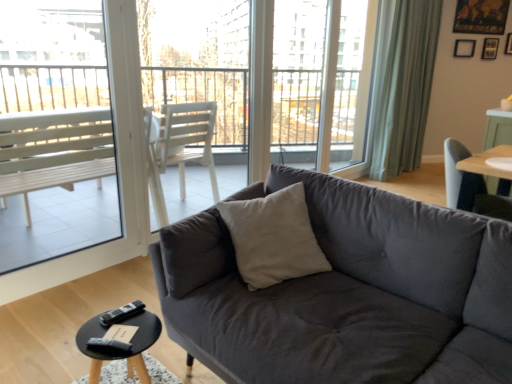
Question: Considering the relative sizes of black wood coffee table at lower left and black matte picture frame at upper right, marked as the 1th picture frame in a left-to-right arrangement, in the image provided, is black wood coffee table at lower left taller than black matte picture frame at upper right, marked as the 1th picture frame in a left-to-right arrangement,?

Choices:
 (A) no
 (B) yes

Answer: (B)

Question: Is black wood coffee table at lower left facing towards black matte picture frame at upper right, the 2th picture frame viewed from the right?

Choices:
 (A) no
 (B) yes

Answer: (A)

Question: Considering the relative sizes of black wood coffee table at lower left and black matte picture frame at upper right, the 2th picture frame viewed from the right, in the image provided, is black wood coffee table at lower left smaller than black matte picture frame at upper right, the 2th picture frame viewed from the right,?

Choices:
 (A) yes
 (B) no

Answer: (B)

Question: Is black wood coffee table at lower left next to black matte picture frame at upper right, the 2th picture frame viewed from the right?

Choices:
 (A) no
 (B) yes

Answer: (A)

Question: Is black wood coffee table at lower left at the left side of black matte picture frame at upper right, the 2th picture frame viewed from the right?

Choices:
 (A) yes
 (B) no

Answer: (A)

Question: From the image's perspective, is dark gray fabric couch at center above or below wooden picture frame at upper right, the 1th picture frame in the right-to-left sequence?

Choices:
 (A) above
 (B) below

Answer: (B)

Question: In the image, is dark gray fabric couch at center positioned in front of or behind wooden picture frame at upper right, the 1th picture frame in the right-to-left sequence?

Choices:
 (A) front
 (B) behind

Answer: (A)

Question: Does point (312, 196) appear closer or farther from the camera than point (492, 46)?

Choices:
 (A) farther
 (B) closer

Answer: (B)

Question: In terms of width, does dark gray fabric couch at center look wider or thinner when compared to wooden picture frame at upper right, which is counted as the 2th picture frame, starting from the left?

Choices:
 (A) thin
 (B) wide

Answer: (B)

Question: From a real-world perspective, is beige textured pillow at center above or below dark gray fabric couch at center?

Choices:
 (A) below
 (B) above

Answer: (B)

Question: Looking at the image, does beige textured pillow at center seem bigger or smaller compared to dark gray fabric couch at center?

Choices:
 (A) small
 (B) big

Answer: (A)

Question: Is beige textured pillow at center wider or thinner than dark gray fabric couch at center?

Choices:
 (A) wide
 (B) thin

Answer: (B)

Question: Is point [x=305, y=266] positioned closer to the camera than point [x=362, y=365]?

Choices:
 (A) farther
 (B) closer

Answer: (A)

Question: Is white plastic bench at left, the second window screen from the right, bigger or smaller than green fabric curtain at upper right?

Choices:
 (A) big
 (B) small

Answer: (B)

Question: From a real-world perspective, is white plastic bench at left, the second window screen from the right, above or below green fabric curtain at upper right?

Choices:
 (A) below
 (B) above

Answer: (A)